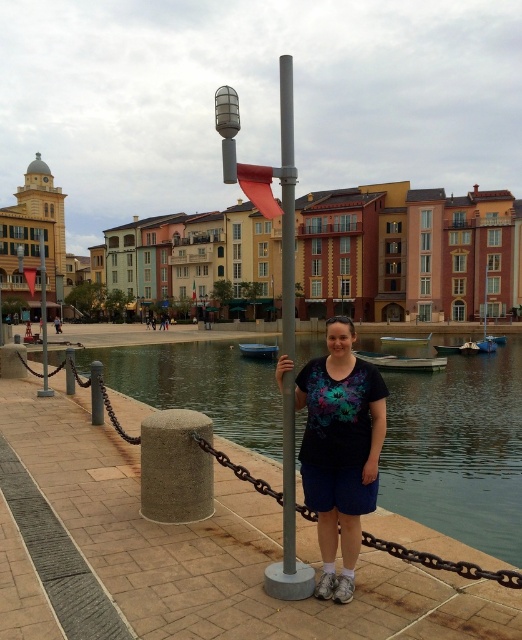
Based on the photo, you are navigating a drone through the waterfront scene. You need to fly from point A at coordinates point (353, 410) to point B at coordinates point (271, 577). Considering the lamppost and the person standing nearby, which point is closer to the lamppost?

Point (271, 577) is closer to the lamppost because point (353, 410) is behind point (271, 577), meaning it is further away from the lamppost.